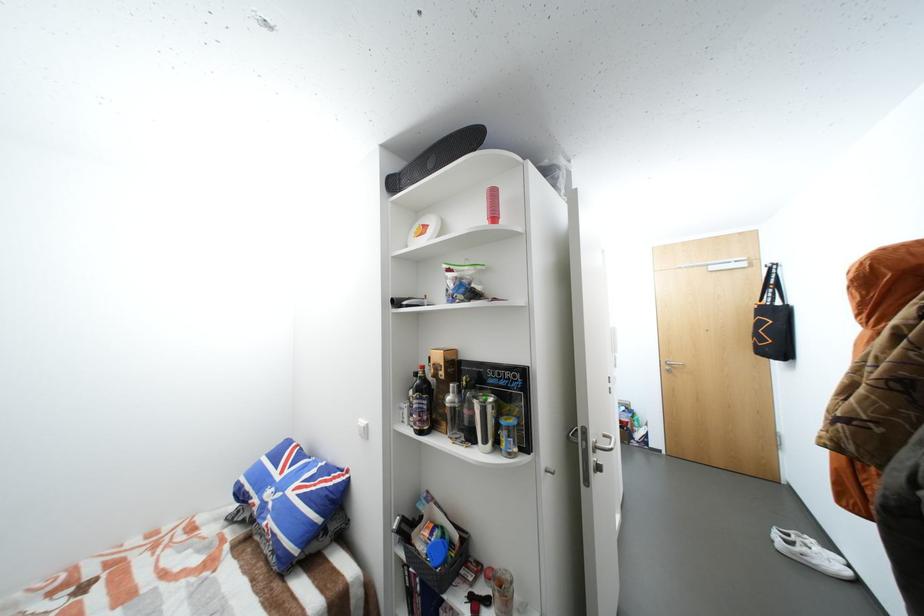
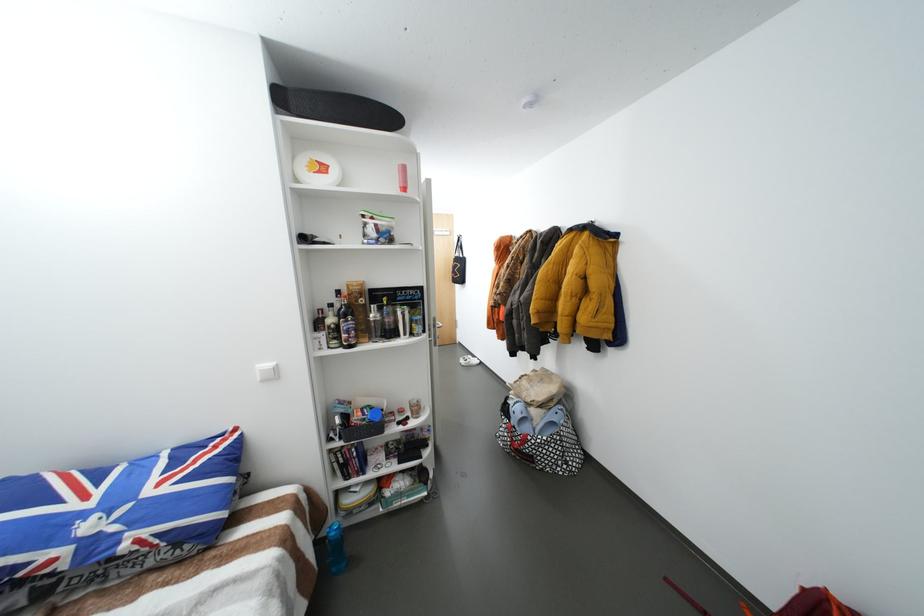
Question: The images are taken continuously from a first-person perspective. In which direction is your viewpoint rotating?

Choices:
 (A) Left
 (B) Right
 (C) Up
 (D) Down

Answer: (B)